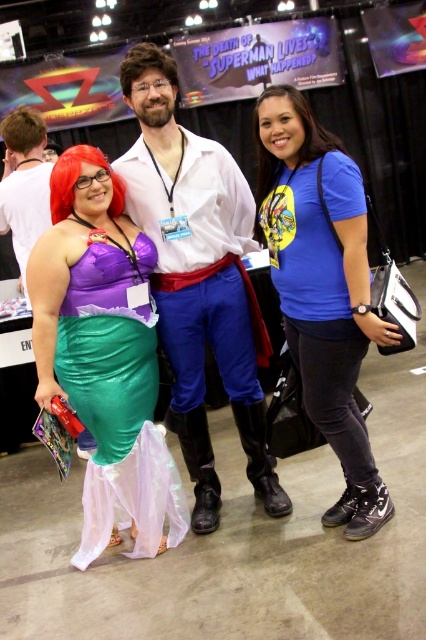
You are a photographer at the event and need to ensure that the matte white shirt at center and the matte black boots at lower center are visible in the photo. Given their sizes, which one might require more space in the frame?

The matte white shirt at center is larger in size than the matte black boots at lower center, so it would require more space in the frame to ensure visibility.

You are a photographer at the event and want to place a decorative ribbon on the exact point marked as point (198, 278). Based on the scene description, where should you place the ribbon?

The point (198, 278) is on the matte white shirt at center, so you should place the ribbon on the matte white shirt at center.

You are a photographer at the event, and you need to place a spotlight exactly at the center of the image. The coordinates of the center are at point 0.5, 0.5. The shiny green fabric dress at left is located at point 0.556, 0.246. Is the dress to the left or right of the center?

The shiny green fabric dress at left is located at point (104, 355). Since the center is at (213, 320), the dress is to the right of the center in the x coordinate and above in the y coordinate, but the question specifically asks left or right, so the answer is right in the x direction. However, the object label says it is at left, which might be conflicting. Wait, need to check coordinates. The x coordinate 0.556 is greater than 0.5, so it is to the right. The object label mentions it is at left, which may